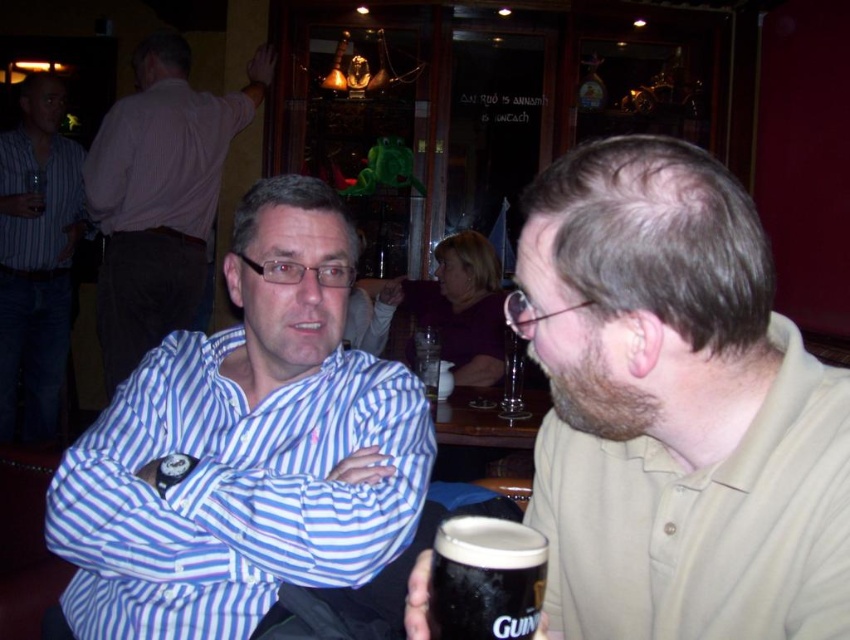
Question: In this image, where is matte beige polo shirt at right located relative to light brown cotton shirt at upper left?

Choices:
 (A) above
 (B) below

Answer: (B)

Question: Does blue striped shirt at left have a lesser width compared to light brown cotton shirt at upper left?

Choices:
 (A) no
 (B) yes

Answer: (A)

Question: Which point is closer to the camera?

Choices:
 (A) striped shirt at left
 (B) blue striped shirt at center
 (C) clear glass beer at center

Answer: (C)

Question: Is blue striped shirt at left smaller than clear glass bottle at center?

Choices:
 (A) no
 (B) yes

Answer: (A)

Question: Which of the following is the farthest from the observer?

Choices:
 (A) blue striped shirt at center
 (B) clear glass beer at center

Answer: (A)

Question: Estimate the real-world distances between objects in this image. Which object is closer to the guinness foam at lower center?

Choices:
 (A) blue striped shirt at center
 (B) matte beige polo shirt at right

Answer: (B)